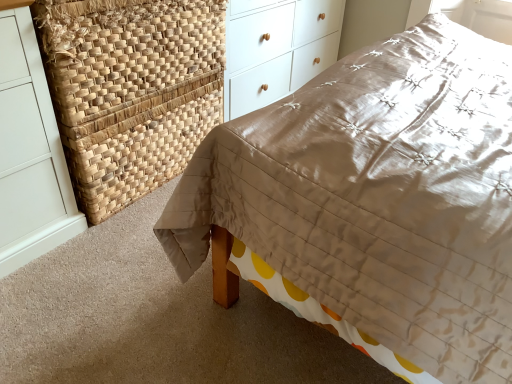
This screenshot has width=512, height=384. I want to click on matte brown quilt at center, so click(x=378, y=196).

You are a GUI agent. You are given a task and a screenshot of the screen. Output one action in this format:
    pyautogui.click(x=<x>, y=<y>)
    Task: Click on the white wood chest of drawers at upper center
    The image size is (512, 384).
    Given the screenshot: What is the action you would take?
    pyautogui.click(x=277, y=49)

Is white wood chest of drawers at upper center wider than natural woven basket at upper left?

Yes.

Would you say white wood chest of drawers at upper center contains natural woven basket at upper left?

No, natural woven basket at upper left is located outside of white wood chest of drawers at upper center.

Which of these two, white wood chest of drawers at upper center or natural woven basket at upper left, is bigger?

Bigger between the two is white wood chest of drawers at upper center.

From a real-world perspective, who is located higher, white wood chest of drawers at upper center or natural woven basket at upper left?

From a 3D spatial view, white wood chest of drawers at upper center is above.

In terms of height, does matte brown quilt at center look taller or shorter compared to white wood chest of drawers at upper center?

Clearly, matte brown quilt at center is taller compared to white wood chest of drawers at upper center.

Looking at this image, is matte brown quilt at center spatially inside white wood chest of drawers at upper center, or outside of it?

The correct answer is: outside.

Find the location of a particular element. bed above the white wood chest of drawers at upper center (from a real-world perspective) is located at coordinates (378, 196).

Is the position of white wood chest of drawers at upper center more distant than that of matte brown quilt at center?

Yes, it is.

From a real-world perspective, is white wood chest of drawers at upper center positioned under matte brown quilt at center based on gravity?

Correct, in the physical world, white wood chest of drawers at upper center is lower than matte brown quilt at center.

Does white wood chest of drawers at upper center have a greater height compared to matte brown quilt at center?

No.

From the image's perspective, is natural woven basket at upper left under matte brown quilt at center?

No.

Is natural woven basket at upper left at the right side of matte brown quilt at center?

Incorrect, natural woven basket at upper left is not on the right side of matte brown quilt at center.

From a real-world perspective, which object rests below the other?

natural woven basket at upper left.

Is natural woven basket at upper left further to camera compared to matte brown quilt at center?

That is True.

From the image's perspective, which is below, natural woven basket at upper left or white wood chest of drawers at upper center?

natural woven basket at upper left is shown below in the image.

Could you tell me if natural woven basket at upper left is facing white wood chest of drawers at upper center?

No, natural woven basket at upper left is not oriented towards white wood chest of drawers at upper center.

Who is smaller, natural woven basket at upper left or white wood chest of drawers at upper center?

natural woven basket at upper left.

Visually, is natural woven basket at upper left positioned to the left or to the right of white wood chest of drawers at upper center?

Clearly, natural woven basket at upper left is on the left of white wood chest of drawers at upper center in the image.

At what (x,y) coordinates should I click in order to perform the action: click on basket above the matte brown quilt at center (from the image's perspective). Please return your answer as a coordinate pair (x, y). Looking at the image, I should click on (131, 90).

Considering the sizes of objects matte brown quilt at center and natural woven basket at upper left in the image provided, who is wider, matte brown quilt at center or natural woven basket at upper left?

matte brown quilt at center.

Between matte brown quilt at center and natural woven basket at upper left, which one is positioned behind?

Positioned behind is natural woven basket at upper left.

From a real-world perspective, who is located lower, matte brown quilt at center or natural woven basket at upper left?

From a 3D spatial view, natural woven basket at upper left is below.

The height and width of the screenshot is (384, 512). I want to click on the chest of drawers behind the natural woven basket at upper left, so click(277, 49).

Where is `bed that appears above the white wood chest of drawers at upper center (from a real-world perspective)`? bed that appears above the white wood chest of drawers at upper center (from a real-world perspective) is located at coordinates (378, 196).

Estimate the real-world distances between objects in this image. Which object is closer to natural woven basket at upper left, white wood chest of drawers at upper center or matte brown quilt at center?

The object closer to natural woven basket at upper left is white wood chest of drawers at upper center.

Looking at the image, which one is located further to white wood chest of drawers at upper center, matte brown quilt at center or natural woven basket at upper left?

Among the two, matte brown quilt at center is located further to white wood chest of drawers at upper center.

When comparing their distances from matte brown quilt at center, does natural woven basket at upper left or white wood chest of drawers at upper center seem closer?

The object closer to matte brown quilt at center is natural woven basket at upper left.

Based on the photo, when comparing their distances from matte brown quilt at center, does white wood chest of drawers at upper center or natural woven basket at upper left seem further?

white wood chest of drawers at upper center.

From the image, which object appears to be farther from white wood chest of drawers at upper center, natural woven basket at upper left or matte brown quilt at center?

matte brown quilt at center is positioned further to the anchor white wood chest of drawers at upper center.

Based on their spatial positions, is matte brown quilt at center or white wood chest of drawers at upper center closer to natural woven basket at upper left?

white wood chest of drawers at upper center lies closer to natural woven basket at upper left than the other object.

You are a GUI agent. You are given a task and a screenshot of the screen. Output one action in this format:
    pyautogui.click(x=<x>, y=<y>)
    Task: Click on the basket positioned between matte brown quilt at center and white wood chest of drawers at upper center from near to far
    The width and height of the screenshot is (512, 384).
    Given the screenshot: What is the action you would take?
    pyautogui.click(x=131, y=90)